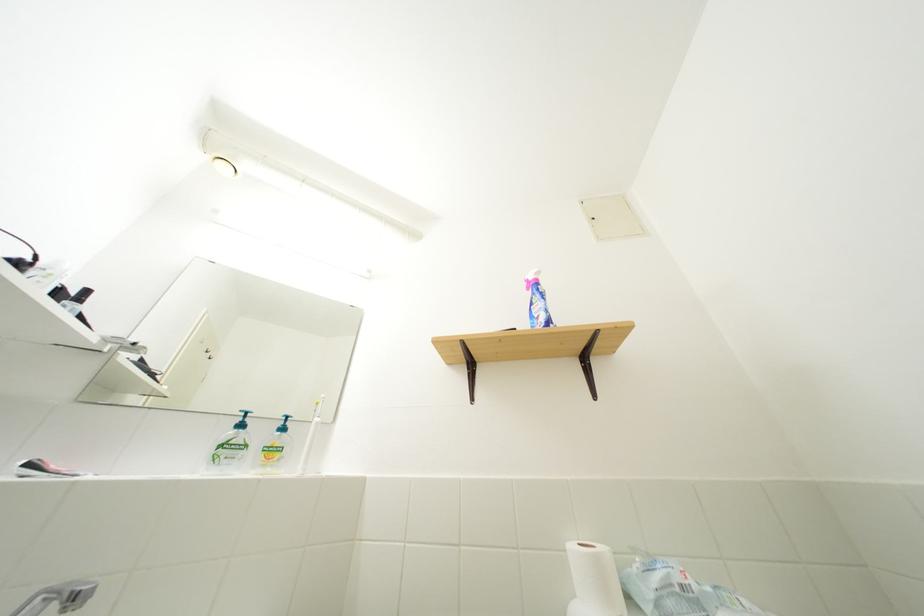
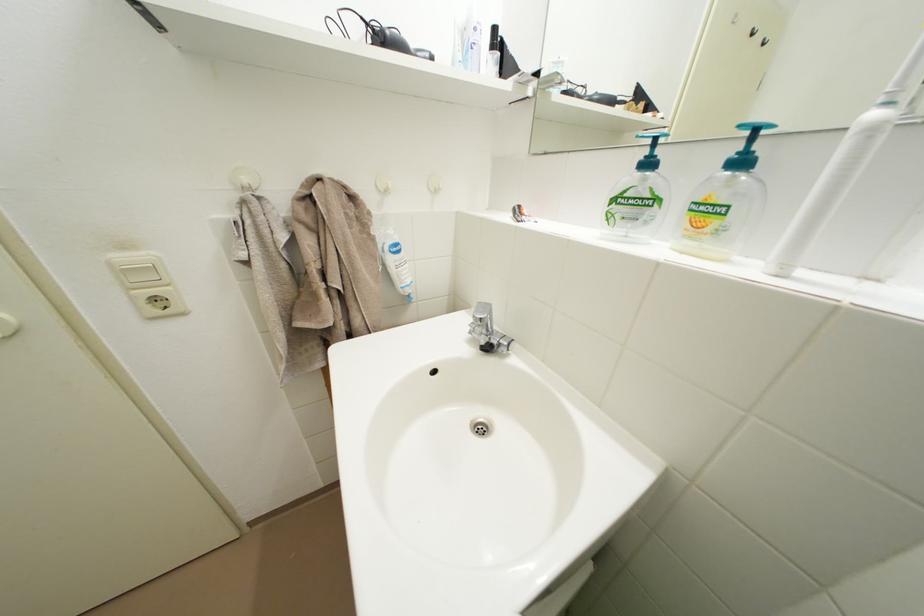
The images are taken continuously from a first-person perspective. In which direction is your viewpoint rotating?

The camera rotated toward left-down.